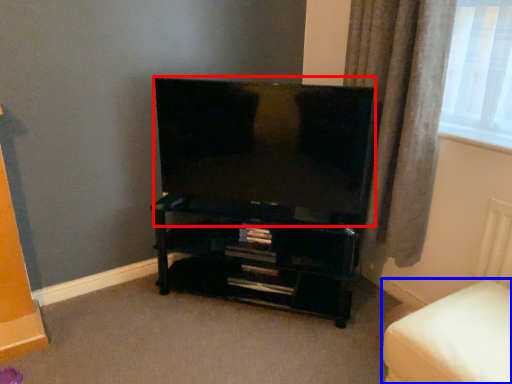
Question: Among these objects, which one is farthest to the camera, television (highlighted by a red box) or furniture (highlighted by a blue box)?

Choices:
 (A) television
 (B) furniture

Answer: (A)